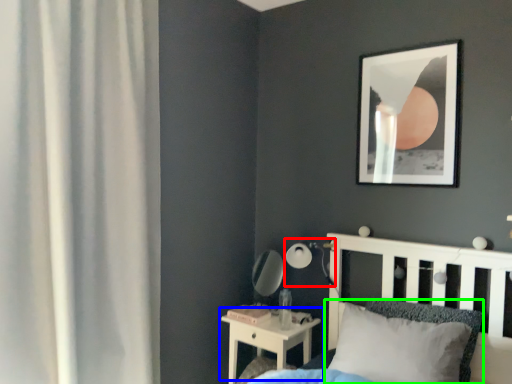
Question: Estimate the real-world distances between objects in this image. Which object is closer to table lamp (highlighted by a red box), nightstand (highlighted by a blue box) or pillow (highlighted by a green box)?

Choices:
 (A) nightstand
 (B) pillow

Answer: (A)